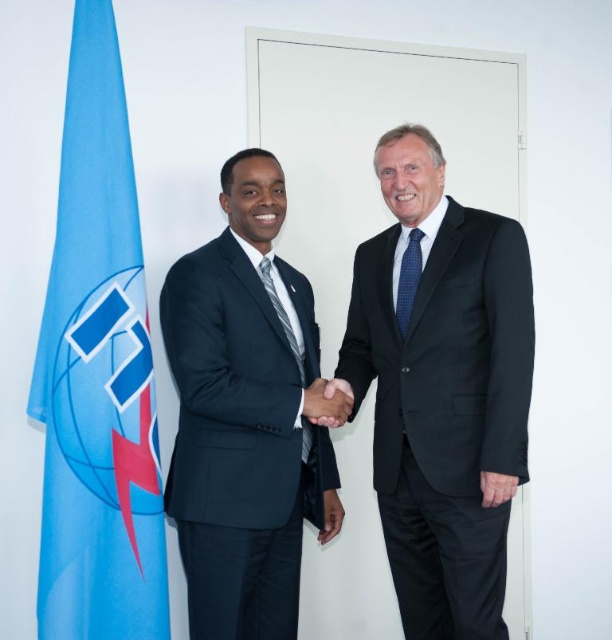
Does navy blue suit at center have a larger size compared to striped fabric tie at center?

Yes.

Find the location of `navy blue suit at center`. navy blue suit at center is located at coordinates (244, 416).

Which of these two, black smooth suit at right or blue fabric flag at left, stands taller?

Standing taller between the two is blue fabric flag at left.

Does black smooth suit at right appear on the right side of blue fabric flag at left?

Correct, you'll find black smooth suit at right to the right of blue fabric flag at left.

Between point (395, 141) and point (80, 202), which one is positioned behind?

Point (395, 141)

What are the coordinates of `black smooth suit at right` in the screenshot? It's located at (442, 392).

Can you confirm if blue fabric flag at left is taller than black smooth hand at center?

Correct, blue fabric flag at left is much taller as black smooth hand at center.

Is blue fabric flag at left closer to the viewer compared to black smooth hand at center?

Yes, it is.

Is point (45, 595) less distant than point (334, 403)?

Yes, point (45, 595) is in front of point (334, 403).

In order to click on blue fabric flag at left in this screenshot , I will do `click(97, 372)`.